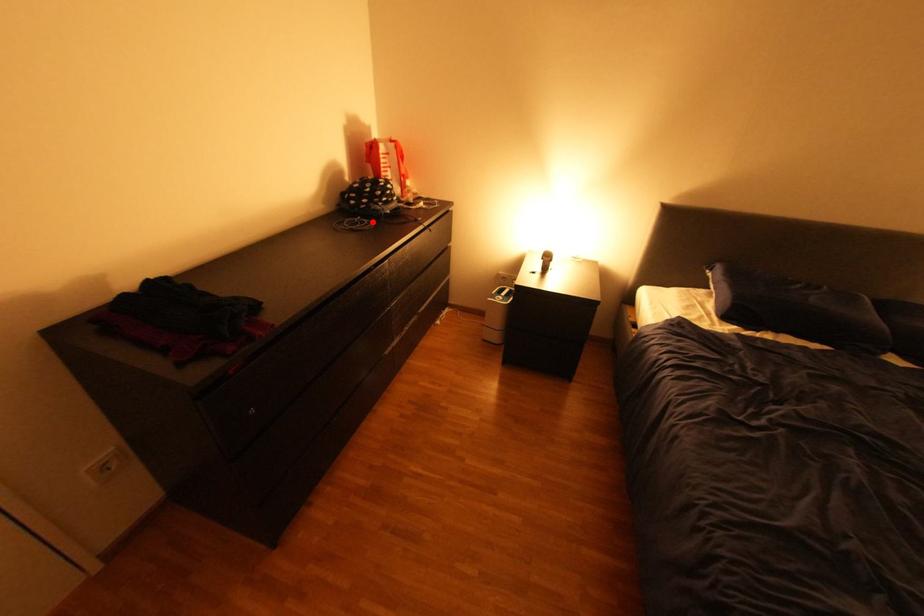
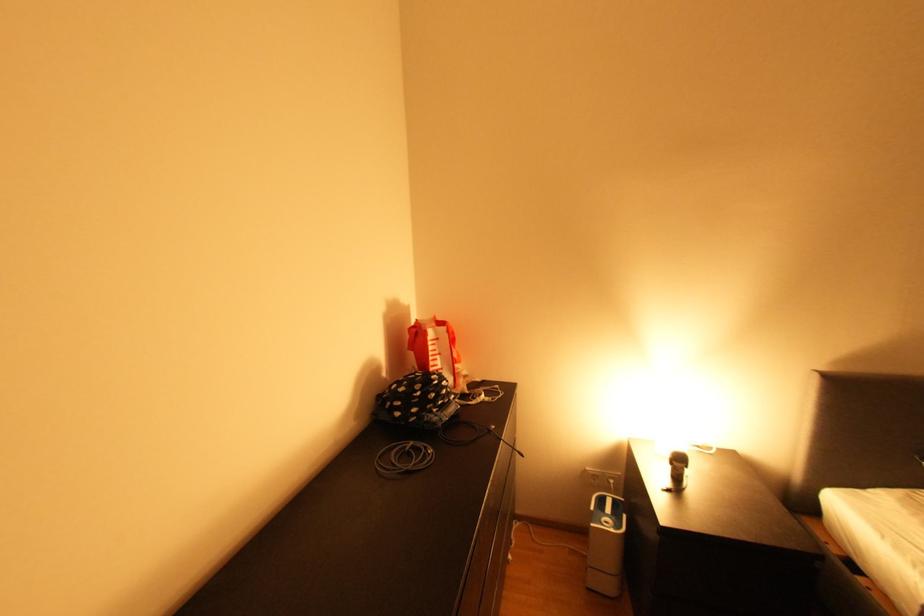
Question: I am providing you with two images of the same scene from different viewpoints. In image1, a red point is highlighted. Considering the same 3D point in image2, which of the following is correct?

Choices:
 (A) It is closer
 (B) It is farther

Answer: (B)